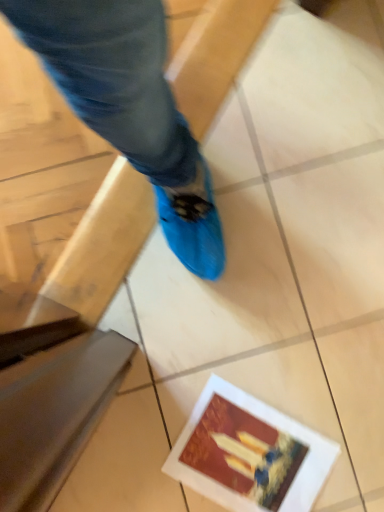
Locate an element on the screen. Image resolution: width=384 pixels, height=512 pixels. free space to the back side of matte paper postcard at lower right is located at coordinates (284, 357).